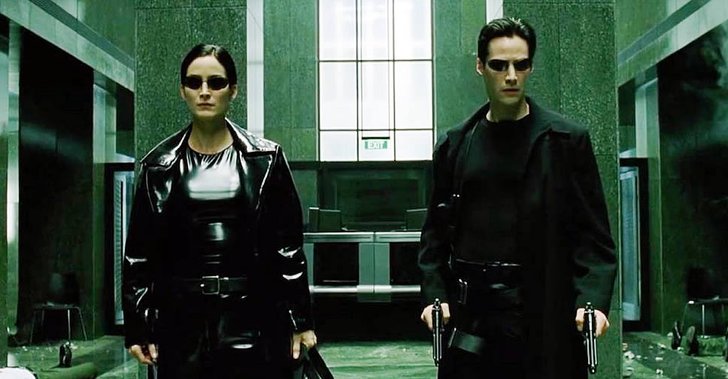
Identify the location of windows. (408, 136), (376, 156), (333, 100), (343, 144), (381, 102), (416, 89), (411, 34), (378, 26), (339, 32).